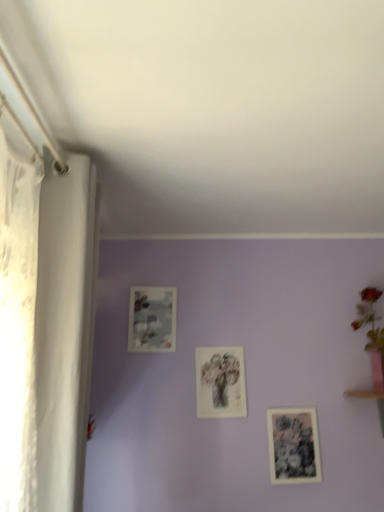
Question: Which direction should I rotate to look at matte floral print at upper center, placed as the 1th picture frame when sorted from left to right, — up or down?

Choices:
 (A) down
 (B) up

Answer: (A)

Question: Is pink ceramic vase at upper right far from matte floral print at center, which appears as the second picture frame when ordered from the bottom?

Choices:
 (A) no
 (B) yes

Answer: (A)

Question: Is pink ceramic vase at upper right to the right of matte floral print at center, which is the 2th picture frame in right-to-left order, from the viewer's perspective?

Choices:
 (A) no
 (B) yes

Answer: (B)

Question: From a real-world perspective, is pink ceramic vase at upper right below matte floral print at center, which appears as the second picture frame when ordered from the bottom?

Choices:
 (A) no
 (B) yes

Answer: (A)

Question: Does pink ceramic vase at upper right appear on the left side of matte floral print at center, arranged as the 2th picture frame when viewed from the left?

Choices:
 (A) no
 (B) yes

Answer: (A)

Question: Can you confirm if pink ceramic vase at upper right is bigger than matte floral print at center, arranged as the 2th picture frame when viewed from the left?

Choices:
 (A) no
 (B) yes

Answer: (B)

Question: Can you confirm if pink ceramic vase at upper right is wider than matte floral print at center, which is the 2th picture frame in right-to-left order?

Choices:
 (A) yes
 (B) no

Answer: (A)

Question: Does pink ceramic vase at upper right have a greater height compared to white sheer curtain at left?

Choices:
 (A) yes
 (B) no

Answer: (B)

Question: Considering the relative sizes of pink ceramic vase at upper right and white sheer curtain at left in the image provided, is pink ceramic vase at upper right thinner than white sheer curtain at left?

Choices:
 (A) no
 (B) yes

Answer: (A)

Question: Is pink ceramic vase at upper right closer to camera compared to white sheer curtain at left?

Choices:
 (A) no
 (B) yes

Answer: (A)

Question: From the image's perspective, would you say pink ceramic vase at upper right is shown under white sheer curtain at left?

Choices:
 (A) yes
 (B) no

Answer: (A)

Question: Can you confirm if pink ceramic vase at upper right is wider than white sheer curtain at left?

Choices:
 (A) yes
 (B) no

Answer: (A)

Question: From a real-world perspective, does pink ceramic vase at upper right stand above white sheer curtain at left?

Choices:
 (A) yes
 (B) no

Answer: (A)

Question: Is matte floral print at upper center, positioned as the 1th picture frame in top-to-bottom order, to the right of black paper picture frame at lower right, acting as the first picture frame starting from the bottom, from the viewer's perspective?

Choices:
 (A) no
 (B) yes

Answer: (A)